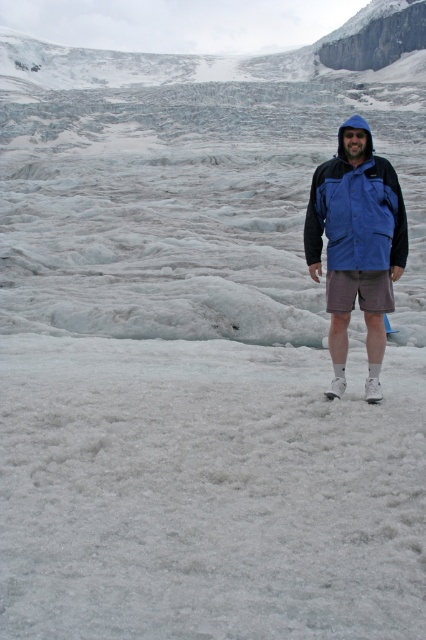
You are a fashion designer observing a model wearing the blue waterproof jacket at center and gray cotton shorts at center. Which clothing item is taller on the model?

The blue waterproof jacket at center is taller than the gray cotton shorts at center.

You are a hiker preparing to cross a glacier. You have a blue waterproof jacket at center and gray cotton shorts at center. Which clothing item is wider when viewed from above?

The blue waterproof jacket at center is wider than the gray cotton shorts at center.

You are standing on the glacier and want to reach the point marked at coordinates point (383, 164). Given that you can walk 10 meters in 2 minutes, how long will it take you to reach that point?

The point (383, 164) is 7.27 meters from viewer, so it will take approximately 1.45 minutes to reach it.